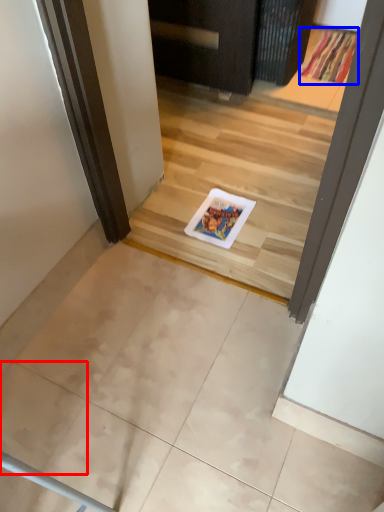
Question: Which of the following is the farthest to the observer, ceramic tile (highlighted by a red box) or doormat (highlighted by a blue box)?

Choices:
 (A) ceramic tile
 (B) doormat

Answer: (B)